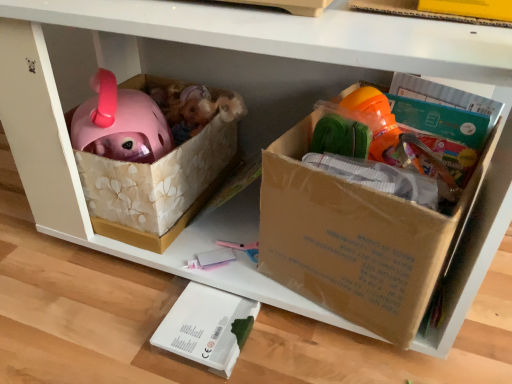
Question: Is white matte box at lower center taller than brown cardboard box at center?

Choices:
 (A) no
 (B) yes

Answer: (A)

Question: Is white matte box at lower center facing away from brown cardboard box at center?

Choices:
 (A) no
 (B) yes

Answer: (A)

Question: Is white matte box at lower center not inside brown cardboard box at center?

Choices:
 (A) yes
 (B) no

Answer: (A)

Question: Considering the relative positions of white matte box at lower center and brown cardboard box at center in the image provided, is white matte box at lower center to the right of brown cardboard box at center from the viewer's perspective?

Choices:
 (A) no
 (B) yes

Answer: (A)

Question: Does white matte box at lower center lie in front of brown cardboard box at center?

Choices:
 (A) no
 (B) yes

Answer: (A)

Question: Are white matte box at lower center and brown cardboard box at center located far from each other?

Choices:
 (A) no
 (B) yes

Answer: (A)

Question: Is brown cardboard box at center positioned behind white matte box at lower center?

Choices:
 (A) no
 (B) yes

Answer: (A)

Question: Does brown cardboard box at center have a greater width compared to white matte box at lower center?

Choices:
 (A) yes
 (B) no

Answer: (A)

Question: Is brown cardboard box at center facing away from white matte box at lower center?

Choices:
 (A) yes
 (B) no

Answer: (B)

Question: From a real-world perspective, is brown cardboard box at center below white matte box at lower center?

Choices:
 (A) no
 (B) yes

Answer: (A)

Question: Is brown cardboard box at center closer to camera compared to white matte box at lower center?

Choices:
 (A) yes
 (B) no

Answer: (A)

Question: From a real-world perspective, is brown cardboard box at center on white matte box at lower center?

Choices:
 (A) no
 (B) yes

Answer: (B)

Question: From the image's perspective, relative to white matte box at lower center, is brown cardboard box at center above or below?

Choices:
 (A) below
 (B) above

Answer: (B)